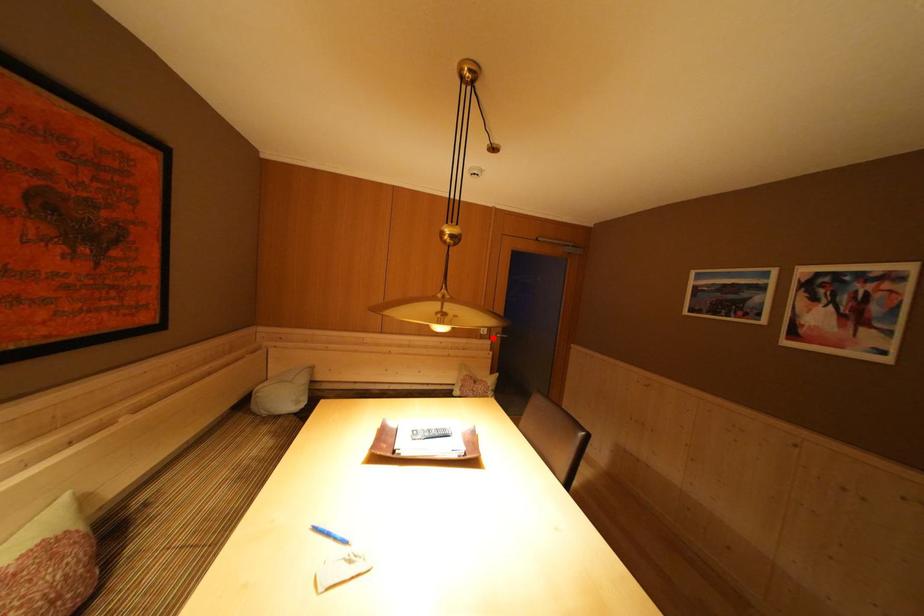
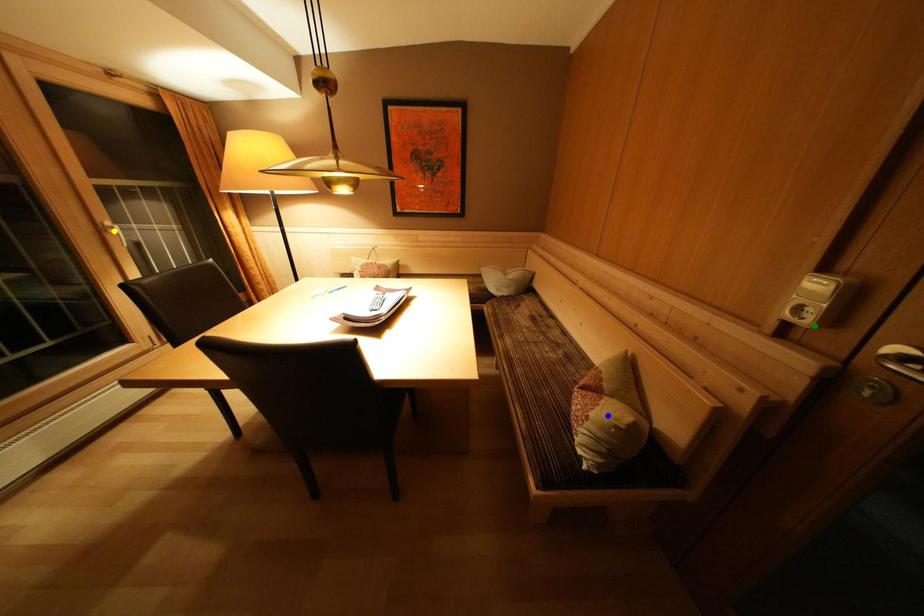
Question: I am providing you with two images of the same scene from different viewpoints. A red point is marked on the first image. You are given multiple points on the second image. In image 2, which mark is for the same physical point as the one in image 1?

Choices:
 (A) blue point
 (B) yellow point
 (C) green point

Answer: (C)